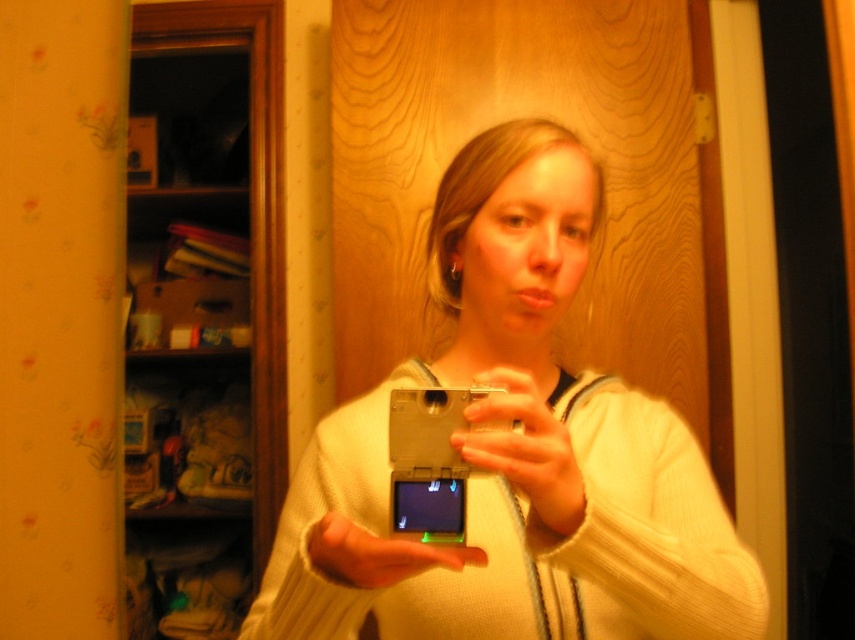
Does silver metallic camera at center have a greater width compared to metallic silver phone at center?

Correct, the width of silver metallic camera at center exceeds that of metallic silver phone at center.

Looking at this image, does silver metallic camera at center have a lesser width compared to metallic silver phone at center?

No, silver metallic camera at center is not thinner than metallic silver phone at center.

Is point (529, 432) positioned before point (463, 483)?

Yes, it is in front of point (463, 483).

Where is `silver metallic camera at center`? silver metallic camera at center is located at coordinates (514, 452).